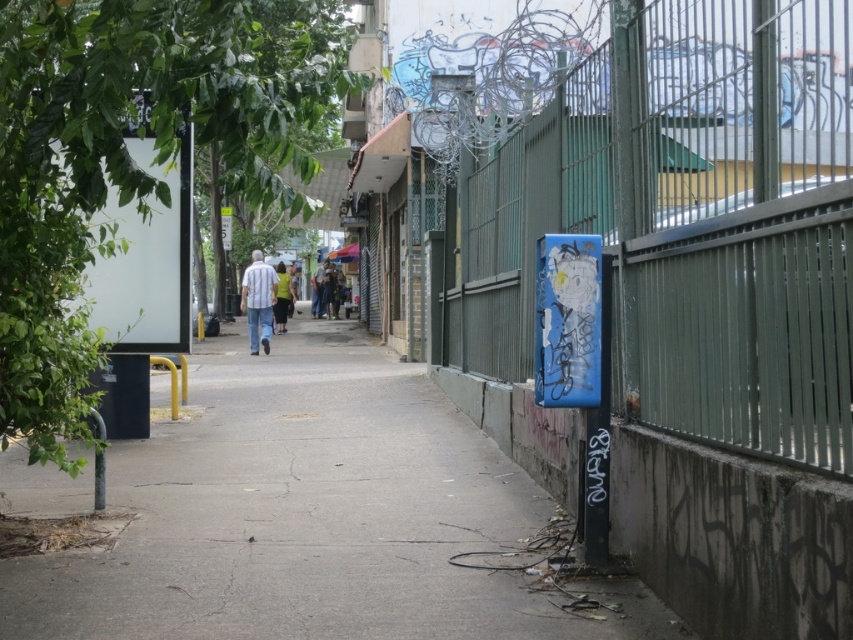
Between gray concrete pavement at center and matte gray pants at center, which one has more height?

matte gray pants at center is taller.

Which is behind, point (387, 548) or point (321, 307)?

The point (321, 307) is behind.

Identify the location of gray concrete pavement at center. point(314,516).

The image size is (853, 640). I want to click on gray concrete pavement at center, so click(x=314, y=516).

Can you confirm if yellow-green shirt at center is taller than transparent plastic umbrella at center?

Yes, yellow-green shirt at center is taller than transparent plastic umbrella at center.

Is point (281, 273) farther from viewer compared to point (329, 252)?

No, (281, 273) is closer to viewer.

Locate an element on the screen. This screenshot has width=853, height=640. yellow-green shirt at center is located at coordinates (282, 298).

Where is `yellow-green shirt at center`? yellow-green shirt at center is located at coordinates (282, 298).

Who is more distant from viewer, (476,486) or (347,248)?

Positioned behind is point (347,248).

Does gray concrete pavement at center lie behind transparent plastic umbrella at center?

No, gray concrete pavement at center is in front of transparent plastic umbrella at center.

Which is in front, point (171, 625) or point (345, 244)?

Point (171, 625)

Where is `gray concrete pavement at center`? Image resolution: width=853 pixels, height=640 pixels. gray concrete pavement at center is located at coordinates (314, 516).